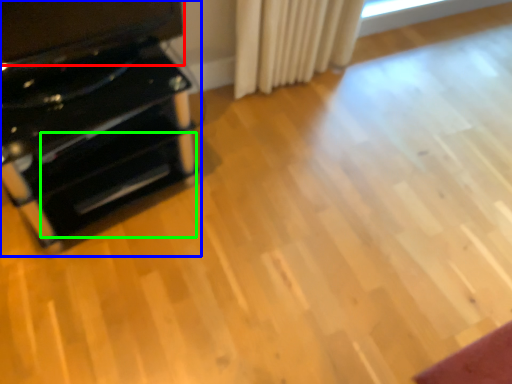
Question: Estimate the real-world distances between objects in this image. Which object is farther from wide (highlighted by a red box), furniture (highlighted by a blue box) or drawer (highlighted by a green box)?

Choices:
 (A) furniture
 (B) drawer

Answer: (B)